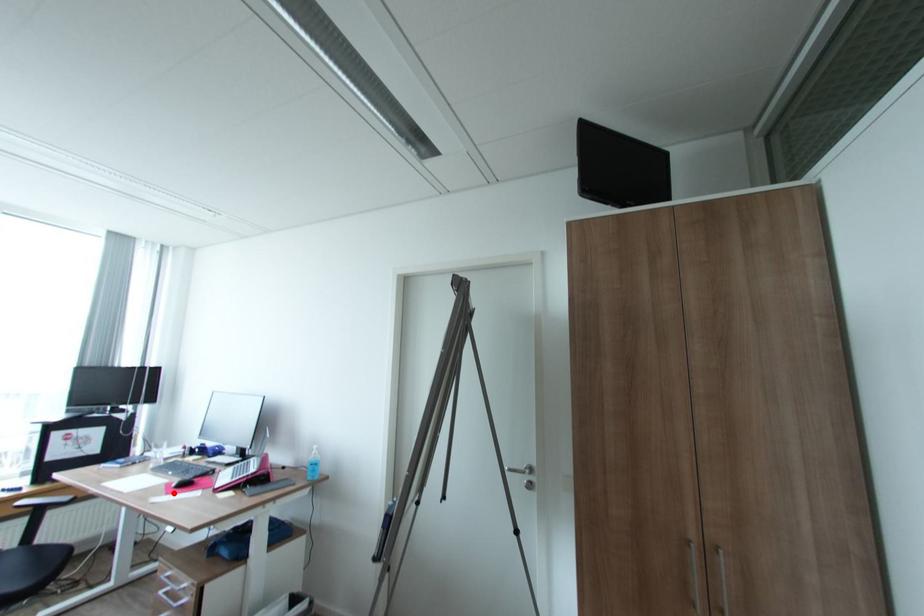
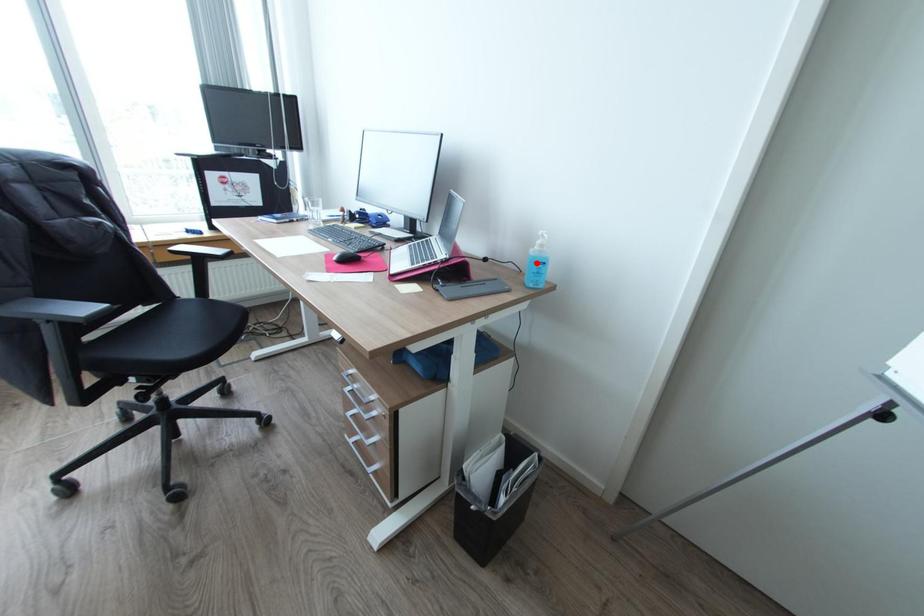
I am providing you with two images of the same scene from different viewpoints. A red point is marked on the first image and another point is marked on the second image. Are the points marked in image1 and image2 representing the same 3D position?

No